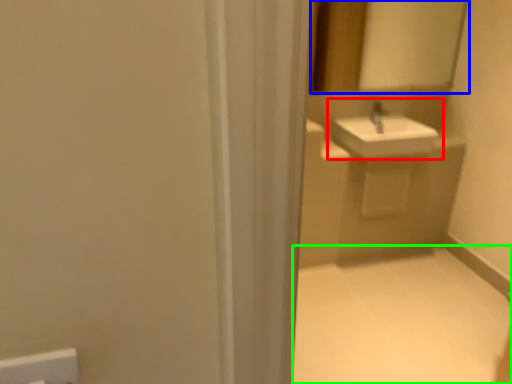
Question: Based on their relative distances, which object is farther from sink (highlighted by a red box)? Choose from mirror (highlighted by a blue box) and plain (highlighted by a green box).

Choices:
 (A) mirror
 (B) plain

Answer: (B)